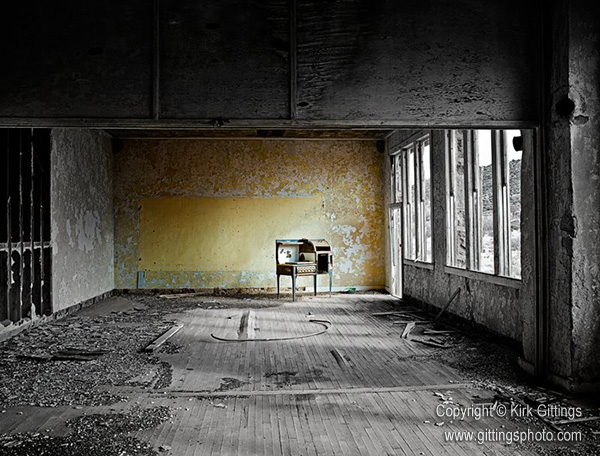
Where is `old desk`? The height and width of the screenshot is (456, 600). old desk is located at coordinates tap(295, 263).